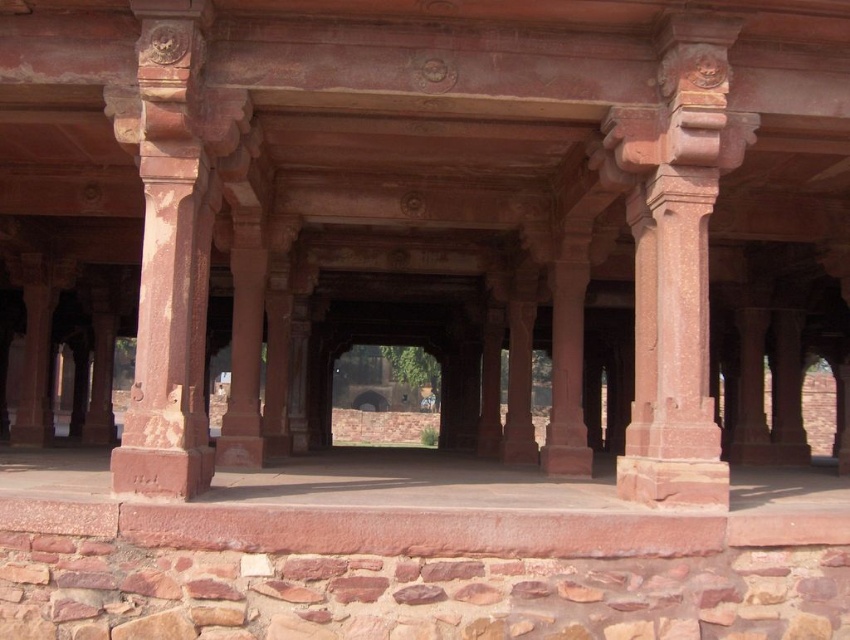
You are an architect planning to install a decorative banner between the rustic stone column at center and the rustic stone column at left. The banner requires 1 meter of space on each side to be secured properly. Is there enough space between the two columns to accommodate the banner?

The rustic stone column at center and rustic stone column at left are 4.89 meters apart from each other. Subtracting the required 1 meter of space on each side for securing the banner, there is 2.89 meters remaining. This should be sufficient space to install the banner between them.

You are standing in the colonnade of a historical structure and want to take a photo of the rustic stone column at center. To ensure the column is centered in your photo, where should you position yourself relative to the column?

To center the rustic stone column at center in your photo, position yourself directly in front of it at point (676, 259), ensuring the column is aligned with the center of your camera frame.

You are standing in the colonnade of the historical structure and want to move from the rustic stone column at left to the rustic stone column at center. Which direction should you move to reach it?

The rustic stone column at center is to the right of the rustic stone column at left, so you should move to the right to reach it.